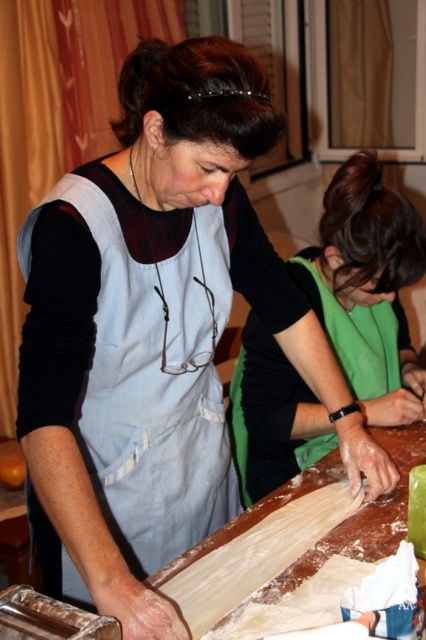
Based on the scene description, what is the 2D coordinate of the light blue fabric apron at center?

The light blue fabric apron at center is located at the 2D coordinate point of (123, 378).

You are a chef preparing for a baking competition and need to choose an apron that covers more of your clothing. Looking at the light blue fabric apron at center and the green fabric apron at center, which one should you pick?

The light blue fabric apron at center is bigger than the green fabric apron at center, so you should pick the light blue fabric apron at center to cover more of your clothing.

You are standing in the kitchen and want to reach both points. Which point, point (178,269) or point (396,410), is closer to you?

Point (178,269) is closer to the viewer than point (396,410).